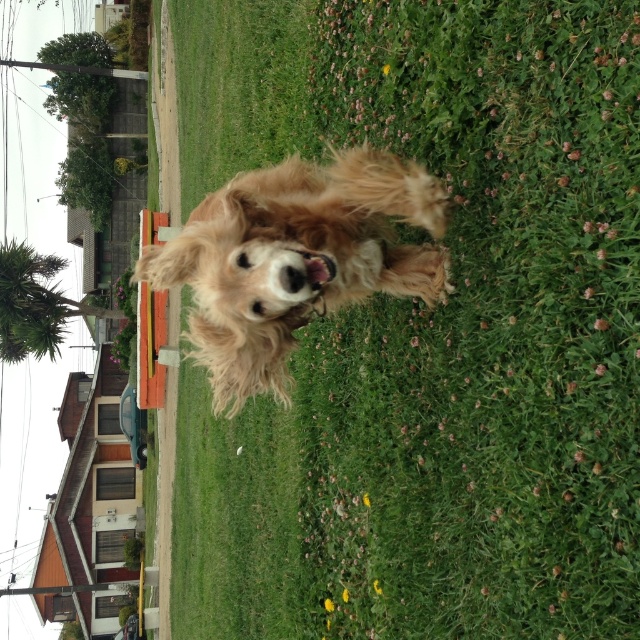
You are standing at the edge of the grassy area and want to throw a ball to the green grass at center. Where should you aim to hit the grass?

You should aim for point (440, 323) to hit the green grass at center.

You are a photographer trying to capture the golden fur dog at center and the green soft grass at center in a single shot. Since the grass is to the left of the dog, where should you position your camera to ensure both are in frame?

The green soft grass at center is to the left of the golden fur dog at center, so you should position your camera to the left side of the dog to include both the grass and the dog in the frame.

You are standing on the green grass at center and want to move to the green soft grass at center. Which direction should you walk to reach it?

The green grass at center is positioned on the right side of green soft grass at center, so you should walk to the left to reach the green soft grass at center.